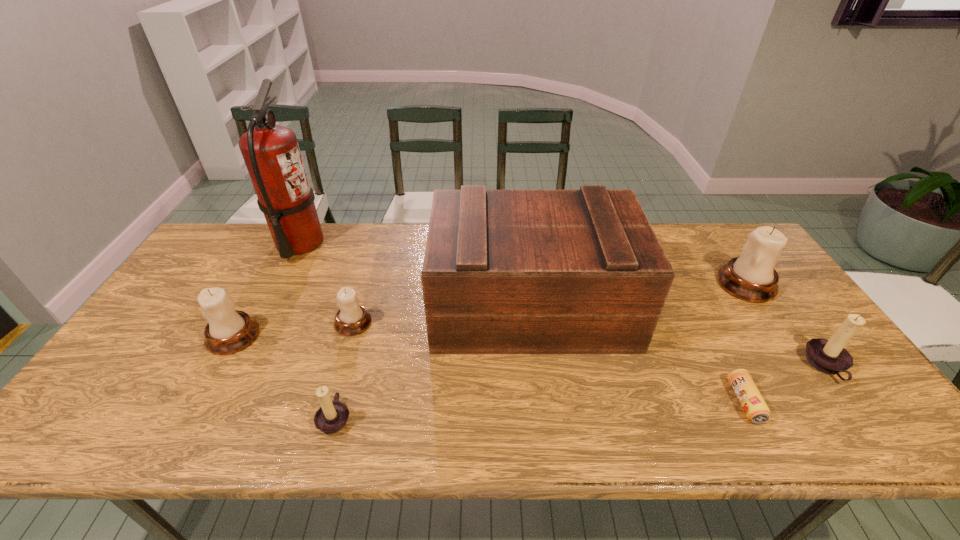
Locate an element on the screen. Image resolution: width=960 pixels, height=540 pixels. vacant region located 0.260m on the wick of the farther brown candle holder is located at coordinates (703, 366).

Locate an element on the screen. This screenshot has height=540, width=960. vacant space located on the wick of the farther brown candle holder is located at coordinates (779, 366).

Locate an element on the screen. The height and width of the screenshot is (540, 960). free location located on the back of the second white candle holder from right to left is located at coordinates 377,241.

Locate an element on the screen. This screenshot has width=960, height=540. vacant area situated on the wick of the smaller brown candle holder is located at coordinates (516, 417).

This screenshot has height=540, width=960. I want to click on vacant space situated on the back of the sixth object from left to right, so click(x=679, y=275).

Find the location of a particular element. The height and width of the screenshot is (540, 960). object present at the far edge is located at coordinates pyautogui.click(x=271, y=153).

Identify the location of candle holder that is at the near edge. The width and height of the screenshot is (960, 540). (331, 417).

The height and width of the screenshot is (540, 960). Identify the location of beer can at the near edge. (752, 402).

In the image, there is a desktop. Where is `blank space at the far edge`? The width and height of the screenshot is (960, 540). blank space at the far edge is located at coordinates (386, 233).

Locate an element on the screen. The image size is (960, 540). free space at the near edge of the desktop is located at coordinates (246, 418).